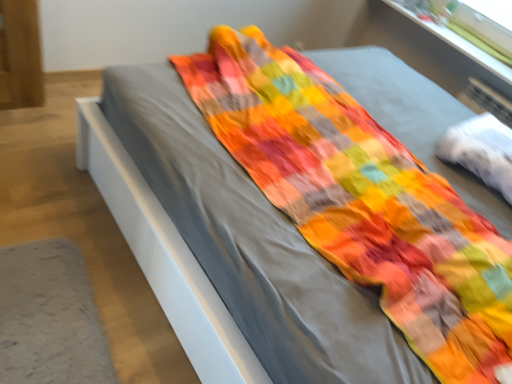
Image resolution: width=512 pixels, height=384 pixels. Describe the element at coordinates (481, 150) in the screenshot. I see `white soft pillow at right` at that location.

Measure the distance between point (478, 147) and camera.

A distance of 5.71 feet exists between point (478, 147) and camera.

Locate an element on the screen. The width and height of the screenshot is (512, 384). white soft pillow at right is located at coordinates (481, 150).

You are a GUI agent. You are given a task and a screenshot of the screen. Output one action in this format:
    pyautogui.click(x=<x>, y=<y>)
    Task: Click on the white soft pillow at right
    
    Given the screenshot: What is the action you would take?
    [481, 150]